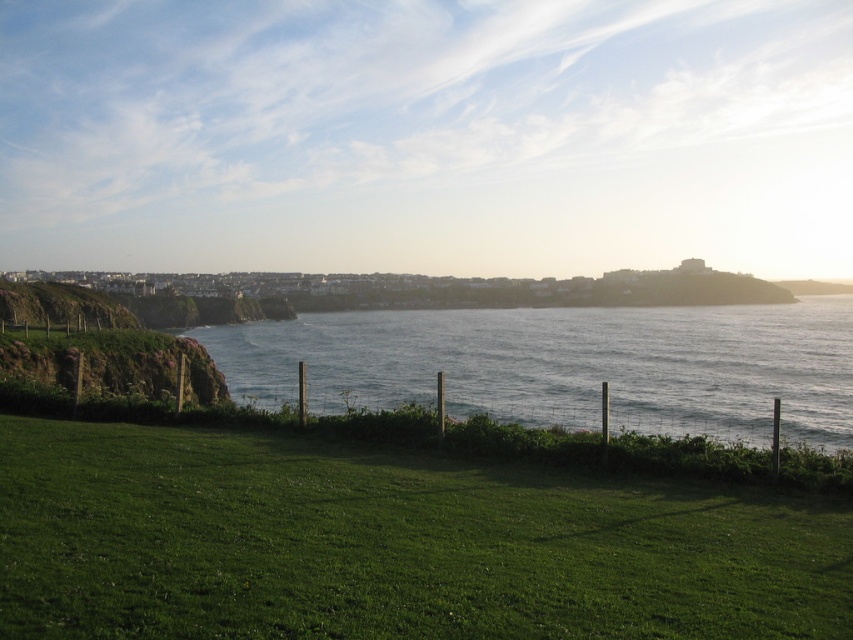
Can you confirm if green grassy at lower center is positioned to the right of blue water at center?

No, green grassy at lower center is not to the right of blue water at center.

Based on the photo, can you confirm if green grassy at lower center is positioned to the left of blue water at center?

Indeed, green grassy at lower center is positioned on the left side of blue water at center.

Does point (213, 547) come in front of point (727, 330)?

Yes, point (213, 547) is closer to viewer.

Where is `green grassy at lower center`? green grassy at lower center is located at coordinates (389, 545).